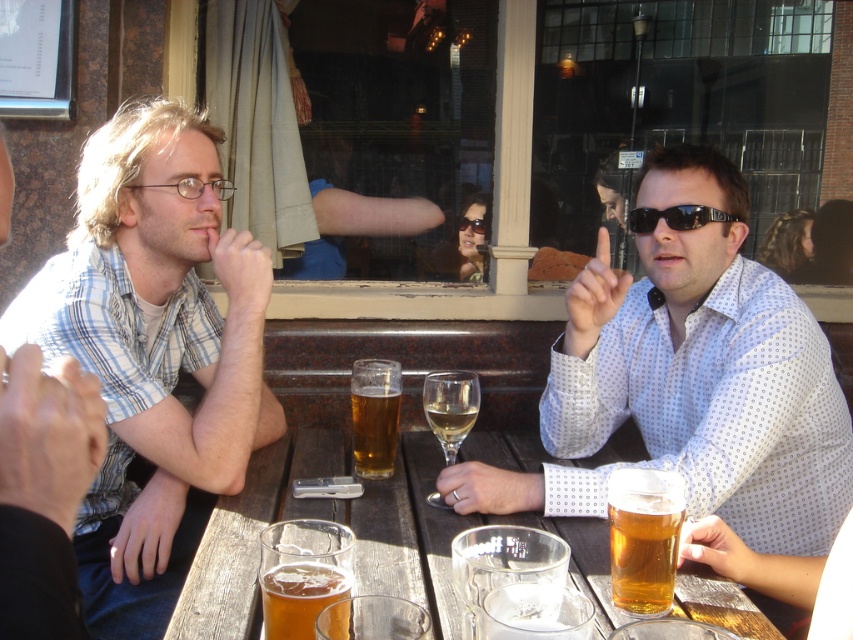
You are standing at the center of the scene. Which direction should you look to see the light blue plaid shirt at left?

The light blue plaid shirt at left is located at point 0.552 on the x axis and 0.181 on the y axis. Since you are at the center, you should look towards the left side of the scene to see the light blue plaid shirt at left.

You are a waiter serving drinks at an outdoor cafe. You need to place a new drink order for the customer seated at the wooden table at center. Where should you place the drink so it doesn not obstruct the translucent glass mug at center?

The translucent glass mug at center is behind the wooden table at center, so you should place the new drink order in front of the wooden table at center to avoid obstructing the translucent glass mug at center.

You are a photographer trying to capture a closeup shot of the translucent glass beer at center without including the light blue plaid shirt at left in the frame. Given their positions, is this possible?

The light blue plaid shirt at left might be wider than the translucent glass beer at center, so it might block the view. It depends on the exact width difference.